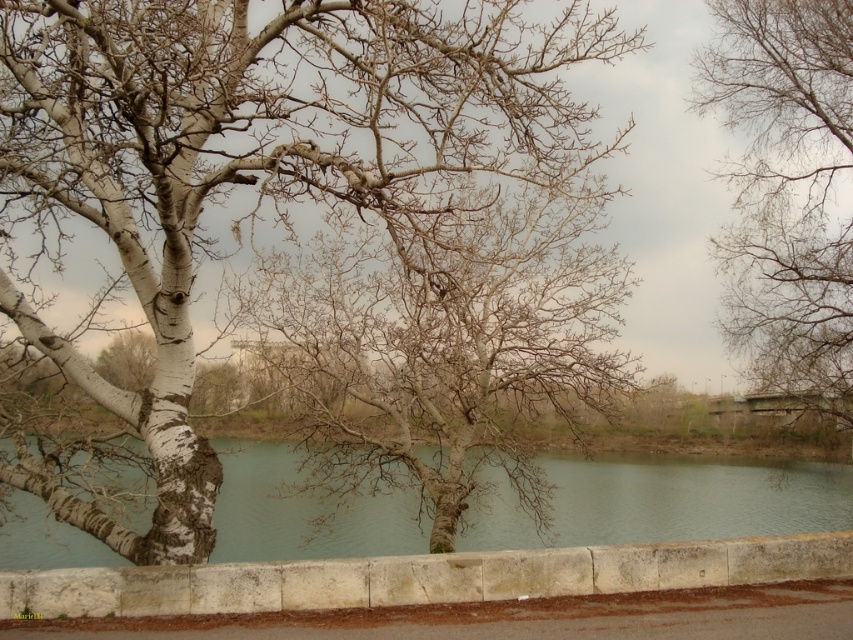
Does point (445, 476) lie behind point (351, 588)?

Yes, point (445, 476) is farther from viewer.

Can you confirm if bare branches at center is positioned below stone curb at lower center?

No, bare branches at center is not below stone curb at lower center.

The height and width of the screenshot is (640, 853). Find the location of `bare branches at center`. bare branches at center is located at coordinates (445, 340).

Does bare branches at upper right appear on the right side of stone curb at lower center?

Correct, you'll find bare branches at upper right to the right of stone curb at lower center.

The height and width of the screenshot is (640, 853). I want to click on bare branches at upper right, so click(787, 189).

Does white bark tree at center appear on the left side of greenish water at center?

Yes, white bark tree at center is to the left of greenish water at center.

Can you confirm if white bark tree at center is shorter than greenish water at center?

Yes.

Is point (450, 52) farther from viewer compared to point (244, 525)?

No, (450, 52) is in front of (244, 525).

In order to click on white bark tree at center in this screenshot , I will do 256,163.